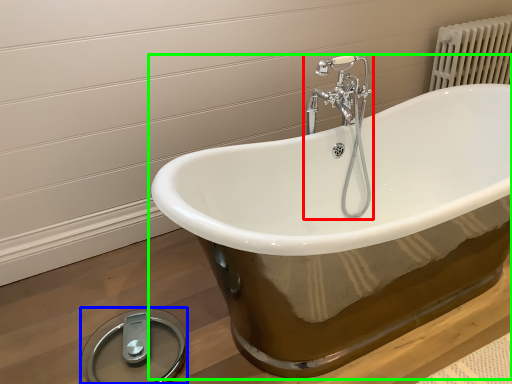
Question: Estimate the real-world distances between objects in this image. Which object is farther from tap (highlighted by a red box), scale (highlighted by a blue box) or bathtub (highlighted by a green box)?

Choices:
 (A) scale
 (B) bathtub

Answer: (A)